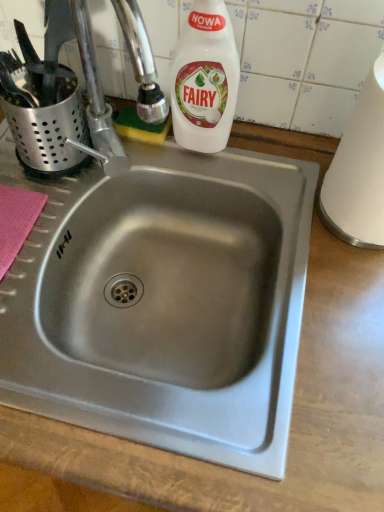
Locate an element on the screen. This screenshot has height=512, width=384. free space to the right of white plastic bottle at upper center is located at coordinates (269, 165).